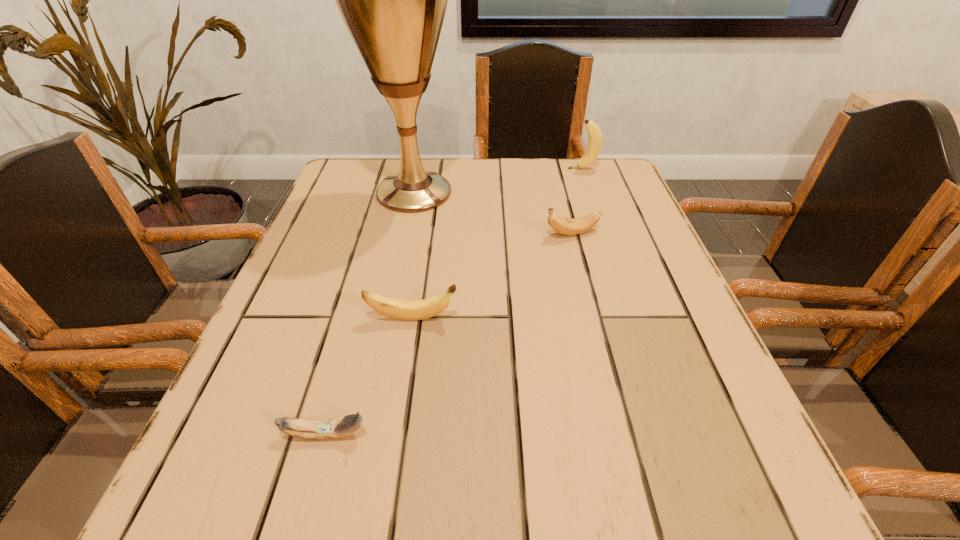
Find the location of a particular element. The width and height of the screenshot is (960, 540). vacant space that satisfies the following two spatial constraints: 1. from the stem of the farthest banana; 2. on the front side of the tallest object is located at coordinates (591, 192).